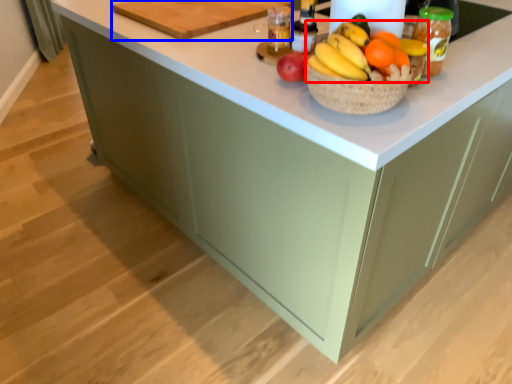
Question: Which of the following is the closest to the observer, grapefruit (highlighted by a red box) or cutting board (highlighted by a blue box)?

Choices:
 (A) grapefruit
 (B) cutting board

Answer: (A)